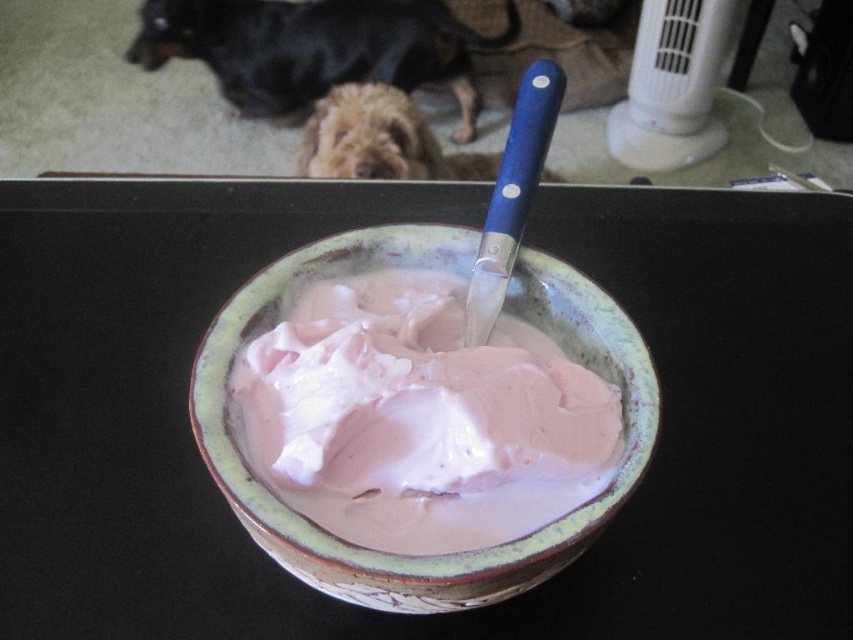
Does pink glazed bowl at center have a greater height compared to fuzzy brown dog at center?

Yes.

This screenshot has height=640, width=853. What do you see at coordinates (444, 556) in the screenshot? I see `pink glazed bowl at center` at bounding box center [444, 556].

Is point (248, 502) less distant than point (318, 168)?

Yes, it is in front of point (318, 168).

Image resolution: width=853 pixels, height=640 pixels. Identify the location of pink glazed bowl at center. (444, 556).

Can you confirm if matte ceramic bowl at center is smaller than black fur dog at upper left?

Incorrect, matte ceramic bowl at center is not smaller in size than black fur dog at upper left.

Does point (572, 609) come behind point (210, 6)?

No, (572, 609) is in front of (210, 6).

Locate an element on the screen. The image size is (853, 640). matte ceramic bowl at center is located at coordinates (422, 221).

Looking at this image, is matte ceramic bowl at center bigger than pink glazed bowl at center?

Indeed, matte ceramic bowl at center has a larger size compared to pink glazed bowl at center.

Who is positioned more to the left, matte ceramic bowl at center or pink glazed bowl at center?

From the viewer's perspective, pink glazed bowl at center appears more on the left side.

Where is `matte ceramic bowl at center`? matte ceramic bowl at center is located at coordinates (422, 221).